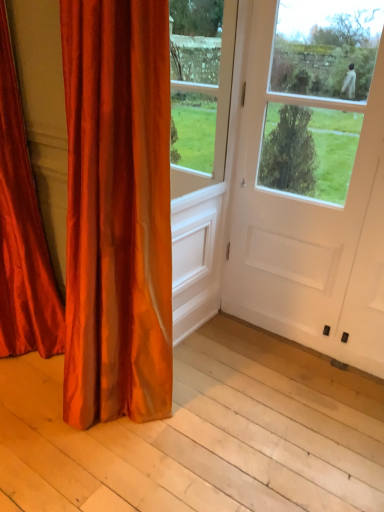
Question: In terms of size, does satin orange curtain at left, the 2th curtain positioned from the left, appear bigger or smaller than white matte door at center?

Choices:
 (A) big
 (B) small

Answer: (A)

Question: Considering the positions of satin orange curtain at left, the 2th curtain positioned from the left, and white matte door at center in the image, is satin orange curtain at left, the 2th curtain positioned from the left, wider or thinner than white matte door at center?

Choices:
 (A) wide
 (B) thin

Answer: (A)

Question: Which object is positioned closest to the satin orange curtain at left, the 2th curtain positioned from the left?

Choices:
 (A) satin red curtain at left, placed as the second curtain when sorted from right to left
 (B) smooth wood plank at lower left
 (C) white matte door at center

Answer: (A)

Question: Which is nearer to the satin red curtain at left, which ranks as the first curtain in left-to-right order?

Choices:
 (A) satin orange curtain at left, which appears as the first curtain when viewed from the right
 (B) white matte door at center
 (C) smooth wood plank at lower left

Answer: (A)